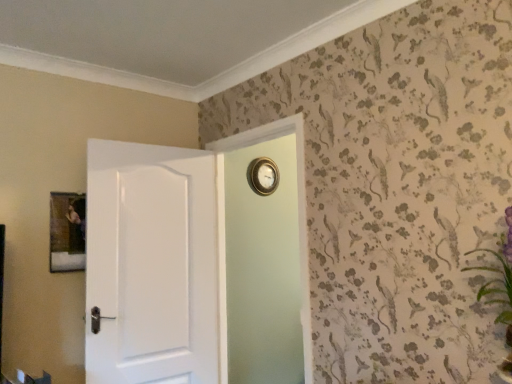
Describe the element at coordinates (197, 263) in the screenshot. I see `white glossy door at left` at that location.

Describe the element at coordinates (263, 176) in the screenshot. This screenshot has width=512, height=384. I see `gold metallic clock at upper center` at that location.

At what (x,y) coordinates should I click in order to perform the action: click on wooden picture frame at upper left. Please return your answer as a coordinate pair (x, y). Looking at the image, I should click on (67, 232).

What is the approximate width of gold metallic clock at upper center?

gold metallic clock at upper center is 4.14 inches wide.

Where is `white glossy door at left`? Image resolution: width=512 pixels, height=384 pixels. white glossy door at left is located at coordinates pos(197,263).

Is gold metallic clock at upper center not close to green textured plant at upper right?

Yes, gold metallic clock at upper center and green textured plant at upper right are quite far apart.

Does gold metallic clock at upper center have a lesser width compared to green textured plant at upper right?

Yes, gold metallic clock at upper center is thinner than green textured plant at upper right.

How different are the orientations of gold metallic clock at upper center and green textured plant at upper right in degrees?

There is a 86.6-degree angle between the facing directions of gold metallic clock at upper center and green textured plant at upper right.

Is gold metallic clock at upper center situated inside green textured plant at upper right or outside?

gold metallic clock at upper center exists outside the volume of green textured plant at upper right.

Looking at this image, which of these two, gold metallic clock at upper center or green textured plant at upper right, stands taller?

gold metallic clock at upper center is taller.

From the picture: From the image's perspective, is gold metallic clock at upper center above or below green textured plant at upper right?

gold metallic clock at upper center is below green textured plant at upper right.

From a real-world perspective, who is located lower, gold metallic clock at upper center or green textured plant at upper right?

From a 3D spatial view, green textured plant at upper right is below.

Visually, is gold metallic clock at upper center positioned to the left or to the right of green textured plant at upper right?

gold metallic clock at upper center is positioned on green textured plant at upper right's left side.

Is white glossy door at left in front of or behind wooden picture frame at upper left in the image?

In the image, white glossy door at left appears in front of wooden picture frame at upper left.

From the image's perspective, which one is positioned lower, white glossy door at left or wooden picture frame at upper left?

white glossy door at left, from the image's perspective.

Considering the positions of objects white glossy door at left and wooden picture frame at upper left in the image provided, who is more to the right, white glossy door at left or wooden picture frame at upper left?

white glossy door at left is more to the right.

Is white glossy door at left positioned far away from wooden picture frame at upper left?

white glossy door at left is actually quite close to wooden picture frame at upper left.

Is wooden picture frame at upper left outside of white glossy door at left?

That's correct, wooden picture frame at upper left is outside of white glossy door at left.

The image size is (512, 384). In order to click on door that is on the right side of wooden picture frame at upper left in this screenshot , I will do (197, 263).

Based on the photo, is wooden picture frame at upper left facing away from white glossy door at left?

No, wooden picture frame at upper left is not facing the opposite direction of white glossy door at left.

From the image's perspective, which is above, green textured plant at upper right or white glossy door at left?

green textured plant at upper right, from the image's perspective.

Where is `floral arrangement that is above the white glossy door at left (from a real-world perspective)`? Image resolution: width=512 pixels, height=384 pixels. floral arrangement that is above the white glossy door at left (from a real-world perspective) is located at coordinates (500, 290).

Looking at their sizes, would you say green textured plant at upper right is wider or thinner than white glossy door at left?

green textured plant at upper right is wider than white glossy door at left.

Which is closer to the camera, (508, 380) or (114, 277)?

Positioned in front is point (508, 380).

Does gold metallic clock at upper center have a smaller size compared to wooden picture frame at upper left?

Actually, gold metallic clock at upper center might be larger than wooden picture frame at upper left.

Is gold metallic clock at upper center placed right next to wooden picture frame at upper left?

No, gold metallic clock at upper center is not next to wooden picture frame at upper left.

In the scene shown: Relative to wooden picture frame at upper left, is gold metallic clock at upper center in front or behind?

gold metallic clock at upper center is in front of wooden picture frame at upper left.

From the image's perspective, is gold metallic clock at upper center on top of white glossy door at left?

Yes.

Would you say gold metallic clock at upper center is inside or outside white glossy door at left?

gold metallic clock at upper center cannot be found inside white glossy door at left.

Is gold metallic clock at upper center oriented towards white glossy door at left?

Yes, gold metallic clock at upper center faces towards white glossy door at left.

Where is `clock lying above the green textured plant at upper right (from the image's perspective)`? The width and height of the screenshot is (512, 384). clock lying above the green textured plant at upper right (from the image's perspective) is located at coordinates (263, 176).

I want to click on floral arrangement lying on the right of gold metallic clock at upper center, so click(x=500, y=290).

From the picture: Considering their positions, is gold metallic clock at upper center positioned closer to white glossy door at left than wooden picture frame at upper left?

wooden picture frame at upper left is positioned closer to the anchor white glossy door at left.

Looking at the image, which one is located closer to gold metallic clock at upper center, wooden picture frame at upper left or green textured plant at upper right?

Among the two, wooden picture frame at upper left is located nearer to gold metallic clock at upper center.

Looking at the image, which one is located closer to gold metallic clock at upper center, wooden picture frame at upper left or white glossy door at left?

white glossy door at left is positioned closer to the anchor gold metallic clock at upper center.

Considering their positions, is gold metallic clock at upper center positioned further to wooden picture frame at upper left than white glossy door at left?

Among the two, gold metallic clock at upper center is located further to wooden picture frame at upper left.

Estimate the real-world distances between objects in this image. Which object is closer to green textured plant at upper right, gold metallic clock at upper center or white glossy door at left?

Based on the image, white glossy door at left appears to be nearer to green textured plant at upper right.

From the image, which object appears to be nearer to gold metallic clock at upper center, white glossy door at left or gold metallic clock at upper center?

The object closer to gold metallic clock at upper center is white glossy door at left.

Looking at the image, which one is located further to wooden picture frame at upper left, gold metallic clock at upper center or green textured plant at upper right?

Among the two, green textured plant at upper right is located further to wooden picture frame at upper left.

From the image, which object appears to be farther from green textured plant at upper right, gold metallic clock at upper center or wooden picture frame at upper left?

Based on the image, wooden picture frame at upper left appears to be further to green textured plant at upper right.

Locate an element on the screen. The image size is (512, 384). door located between wooden picture frame at upper left and gold metallic clock at upper center in the left-right direction is located at coordinates (197, 263).

In order to click on picture frame located between white glossy door at left and gold metallic clock at upper center in the depth direction in this screenshot , I will do `click(67, 232)`.

At what (x,y) coordinates should I click in order to perform the action: click on door positioned between gold metallic clock at upper center and gold metallic clock at upper center from near to far. Please return your answer as a coordinate pair (x, y). Looking at the image, I should click on (197, 263).

Where is `picture frame positioned between gold metallic clock at upper center and gold metallic clock at upper center from near to far`? The width and height of the screenshot is (512, 384). picture frame positioned between gold metallic clock at upper center and gold metallic clock at upper center from near to far is located at coordinates (67, 232).